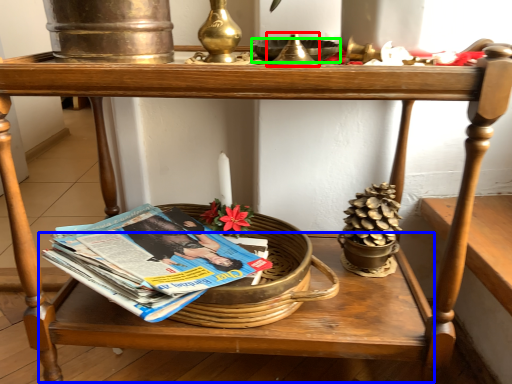
Question: Which object is positioned closest to candle holder (highlighted by a red box)? Select from table (highlighted by a blue box) and bowl (highlighted by a green box).

Choices:
 (A) table
 (B) bowl

Answer: (B)